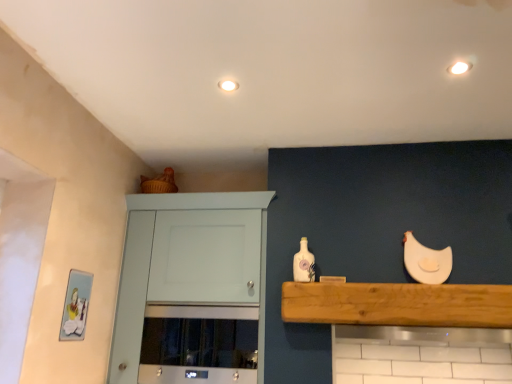
Question: Should I look upward or downward to see white glossy light fixture at upper right, acting as the 1th lighting starting from the front?

Choices:
 (A) up
 (B) down

Answer: (A)

Question: Can you confirm if white glossy bottle at center is positioned to the left of white painted wood cabinet at upper left?

Choices:
 (A) no
 (B) yes

Answer: (A)

Question: From a real-world perspective, is white glossy bottle at center located beneath white painted wood cabinet at upper left?

Choices:
 (A) no
 (B) yes

Answer: (A)

Question: Can you confirm if white glossy bottle at center is thinner than white painted wood cabinet at upper left?

Choices:
 (A) yes
 (B) no

Answer: (A)

Question: Is white painted wood cabinet at upper left inside white glossy bottle at center?

Choices:
 (A) yes
 (B) no

Answer: (B)

Question: Is white glossy bottle at center positioned in front of white painted wood cabinet at upper left?

Choices:
 (A) no
 (B) yes

Answer: (A)

Question: Is white glossy bottle at center next to white painted wood cabinet at upper left?

Choices:
 (A) no
 (B) yes

Answer: (A)

Question: From a real-world perspective, is wooden at upper center located beneath white matte chicken at upper right?

Choices:
 (A) no
 (B) yes

Answer: (B)

Question: Is wooden at upper center closer to the viewer compared to white matte chicken at upper right?

Choices:
 (A) yes
 (B) no

Answer: (A)

Question: Can you confirm if wooden at upper center is shorter than white matte chicken at upper right?

Choices:
 (A) yes
 (B) no

Answer: (A)

Question: Considering the relative positions of wooden at upper center and white matte chicken at upper right in the image provided, is wooden at upper center to the left of white matte chicken at upper right from the viewer's perspective?

Choices:
 (A) yes
 (B) no

Answer: (A)

Question: From the image's perspective, does wooden at upper center appear lower than white matte chicken at upper right?

Choices:
 (A) yes
 (B) no

Answer: (A)

Question: Is wooden at upper center beside white matte chicken at upper right?

Choices:
 (A) no
 (B) yes

Answer: (A)

Question: Considering the relative positions of white painted wood cabinet at upper left and white matte light fixture at upper center, placed as the first lighting when sorted from back to front, in the image provided, is white painted wood cabinet at upper left behind white matte light fixture at upper center, placed as the first lighting when sorted from back to front,?

Choices:
 (A) yes
 (B) no

Answer: (A)